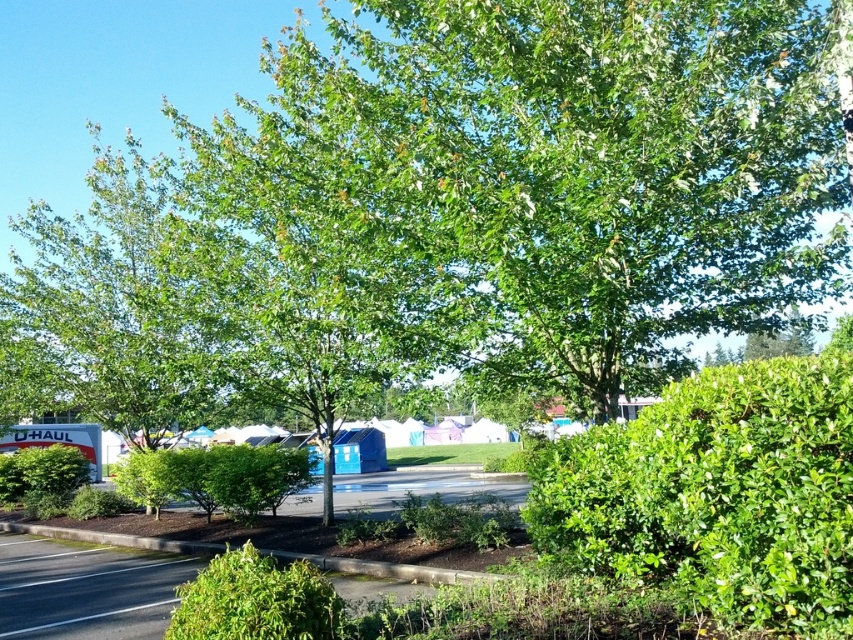
You are a landscape architect designing a garden layout. You have two green leafy bushes available. One is the green leafy bush at center and the other is the green leafy bush at lower left. Based on their sizes, which bush should you place in a location where height is a concern to create a focal point?

The green leafy bush at center is much taller than the green leafy bush at lower left, so you should place the green leafy bush at center in the location where height is a concern to create a focal point.

You are standing at the point with coordinates 0.5,0.5 in the image. Which direction should you move to reach the green leafy bush at center?

The green leafy bush at center is located at coordinates (253,476), so you should move northeast to reach it from your current position at (426,320).

You are standing at the center of the image and want to walk towards the green leafy bush at lower left. Which direction should you move relative to the green leafy hedge at center right?

To reach the green leafy bush at lower left from the center, you should move downward relative to the green leafy hedge at center right, as the hedge is positioned above the bush.